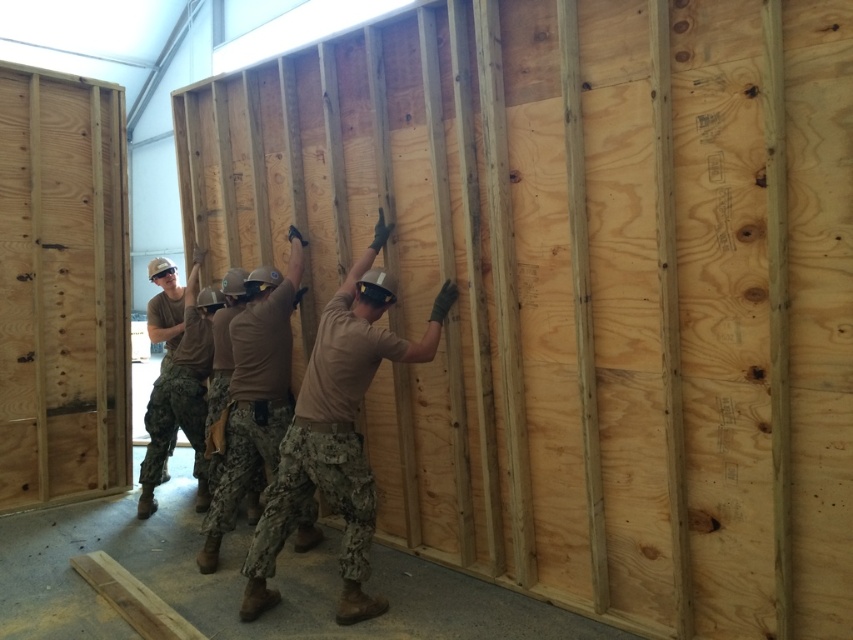
Question: Is tan matte uniform at center thinner than camouflage uniform at center?

Choices:
 (A) yes
 (B) no

Answer: (B)

Question: Which is nearer to the camouflage uniform at center?

Choices:
 (A) tan/camo uniform at center
 (B) tan matte uniform at center

Answer: (B)

Question: Which point appears farthest from the camera in this image?

Choices:
 (A) (202, 385)
 (B) (231, 508)

Answer: (A)

Question: Does camouflage uniform at center lie in front of tan/camo uniform at center?

Choices:
 (A) no
 (B) yes

Answer: (B)

Question: Where is camouflage uniform at center located in relation to tan/camo uniform at center in the image?

Choices:
 (A) left
 (B) right

Answer: (B)

Question: Which object appears farthest from the camera in this image?

Choices:
 (A) tan matte uniform at center
 (B) camouflage uniform at center
 (C) tan/camo uniform at center

Answer: (C)